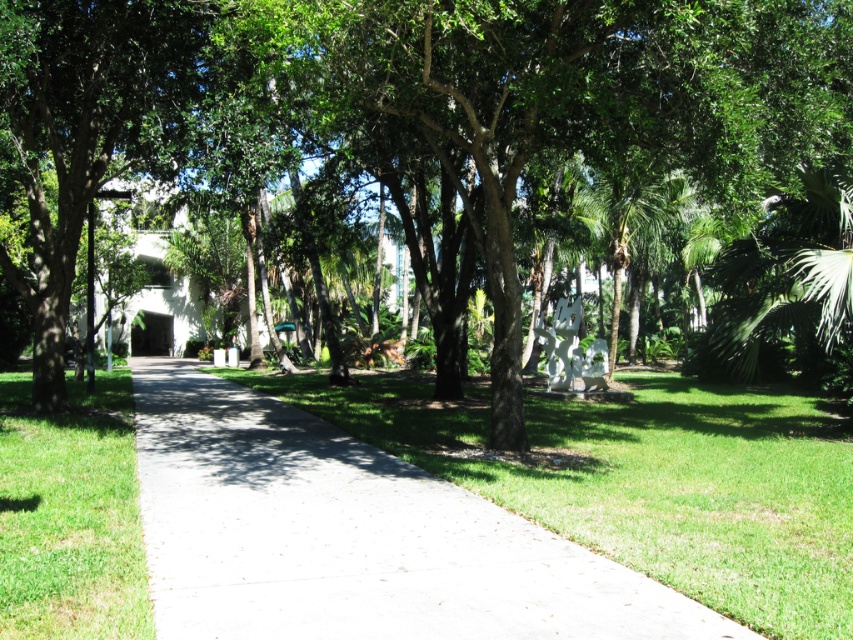
You are a gardener planning to water the green leafy tree at center and the white concrete pavement at center. Since you can only water one, which one is on the right side of the other and should be prioritized?

The green leafy tree at center is positioned on the right side of white concrete pavement at center, so it should be prioritized.

You are a gardener planning to mow the green grass at lower left and the white concrete pavement at center. Which area requires more time to mow?

The green grass at lower left requires more time to mow because it has a larger size compared to the white concrete pavement at center.

You are standing at the point marked by point [352,536] on the white concrete pavement at center. Looking towards the building in the distance, which direction should you walk to stay on the pathway?

The white concrete pavement at center is represented by point [352,536], so you should walk forward along the pathway to reach the building in the distance.